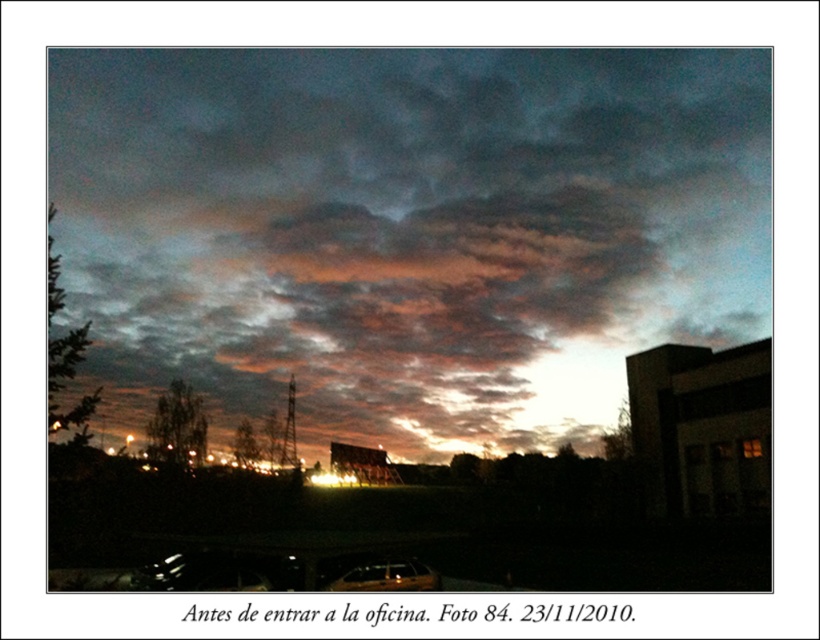
From the picture: You are a photographer trying to capture the metallic gold car at lower center in your shot. The cloudy sky at upper center is taking up most of the frame. How can you adjust your camera angle to ensure the car takes up more of the photo?

To make the metallic gold car at lower center larger in the photo, you can move closer to it or zoom in, since the cloudy sky at upper center is taller than the car and occupies more space in the current frame.

You are a pedestrian standing at the edge of the road and see the metallic silver car at lower center and the transparent glass car window at lower center. Which object is closer to the left side of the road?

The metallic silver car at lower center is positioned on the left side of transparent glass car window at lower center, so it is closer to the left side of the road.